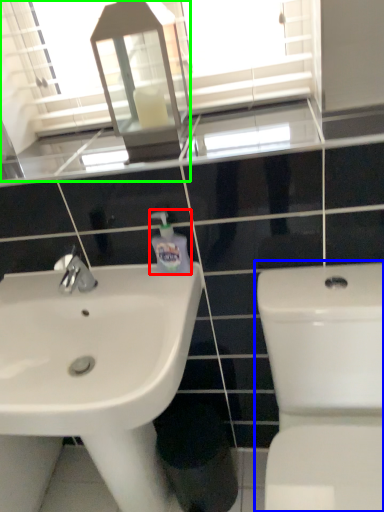
Question: Which object is the closest to the cleaning product (highlighted by a red box)? Choose among these: toilet (highlighted by a blue box) or mirror (highlighted by a green box).

Choices:
 (A) toilet
 (B) mirror

Answer: (A)